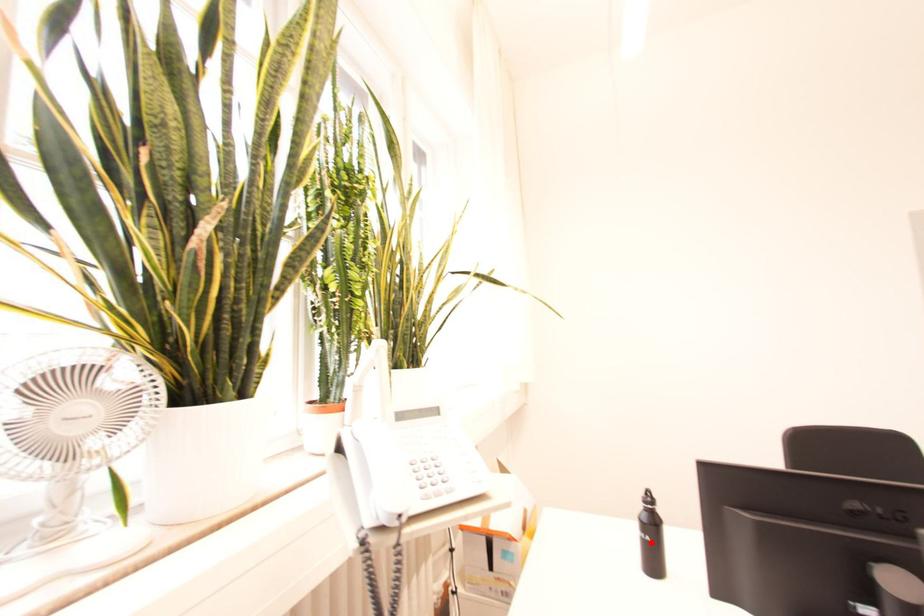
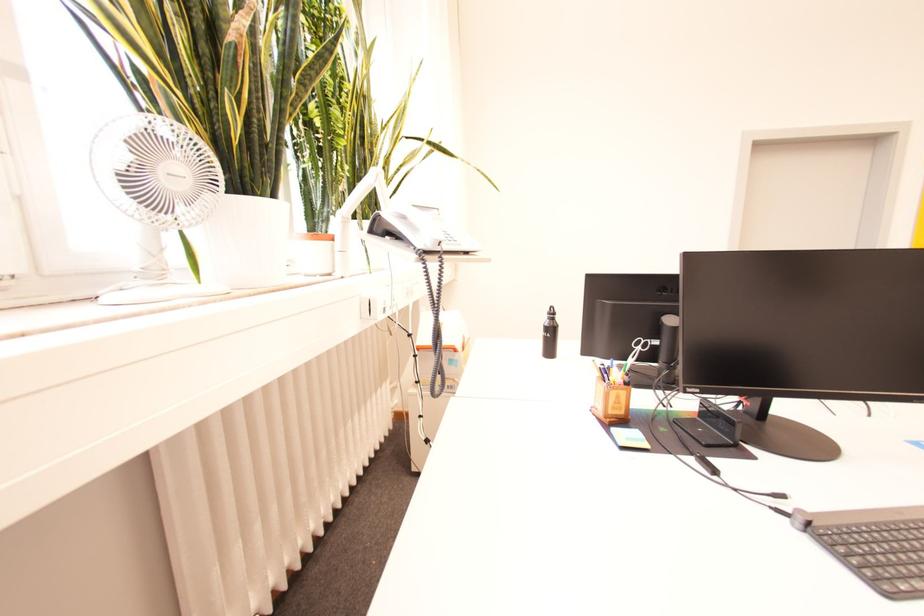
Where in the second image is the point corresponding to the highlighted location from the first image?

(553, 339)